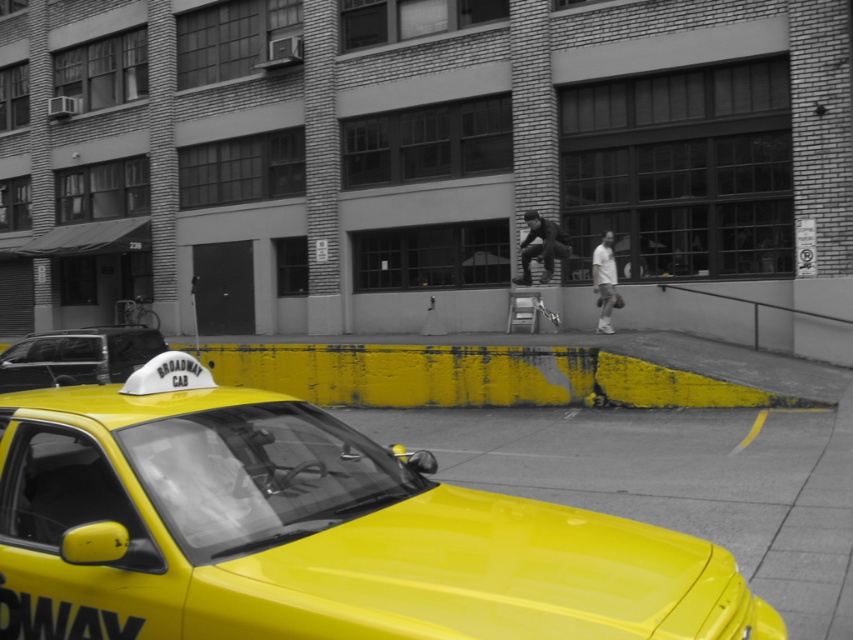
Can you confirm if shiny yellow taxi at lower left is thinner than white matte shirt at center?

In fact, shiny yellow taxi at lower left might be wider than white matte shirt at center.

Which is in front, point (439, 486) or point (608, 328)?

Point (439, 486) is in front.

Is point (329, 516) positioned before point (599, 305)?

Yes, point (329, 516) is closer to viewer.

Identify the location of shiny yellow taxi at lower left. (309, 532).

Does shiny yellow taxi at lower left have a lesser width compared to yellow plastic taxi cab at lower left?

In fact, shiny yellow taxi at lower left might be wider than yellow plastic taxi cab at lower left.

Is point (274, 410) closer to camera compared to point (62, 349)?

Yes, point (274, 410) is closer to viewer.

This screenshot has width=853, height=640. What do you see at coordinates (309, 532) in the screenshot?
I see `shiny yellow taxi at lower left` at bounding box center [309, 532].

You are a GUI agent. You are given a task and a screenshot of the screen. Output one action in this format:
    pyautogui.click(x=<x>, y=<y>)
    Task: Click on the shiny yellow taxi at lower left
    The height and width of the screenshot is (640, 853).
    Given the screenshot: What is the action you would take?
    pyautogui.click(x=309, y=532)

Consider the image. Is the position of yellow plastic taxi cab at lower left less distant than that of dark gray fabric pants at center?

Yes, yellow plastic taxi cab at lower left is in front of dark gray fabric pants at center.

Is yellow plastic taxi cab at lower left smaller than dark gray fabric pants at center?

No, yellow plastic taxi cab at lower left is not smaller than dark gray fabric pants at center.

Is point (36, 346) positioned in front of point (531, 237)?

Yes.

Where is `yellow plastic taxi cab at lower left`? This screenshot has width=853, height=640. yellow plastic taxi cab at lower left is located at coordinates (77, 356).